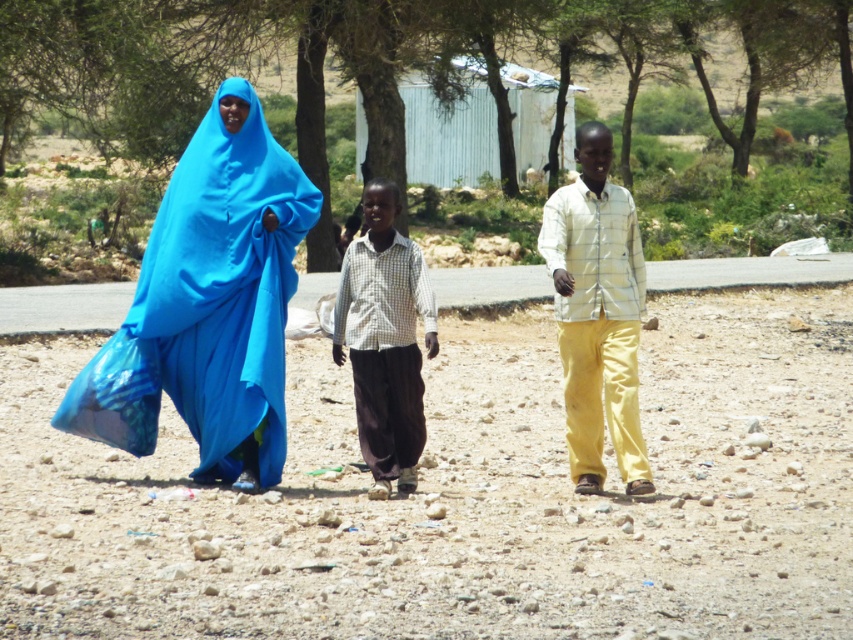
Is dusty gravel at center wider than white checkered shirt at center?

Yes.

Which is in front, point (42, 442) or point (405, 305)?

Positioned in front is point (405, 305).

Between point (728, 401) and point (416, 301), which one is positioned behind?

The point (728, 401) is more distant.

I want to click on dusty gravel at center, so click(x=461, y=497).

Does dusty gravel at center have a smaller size compared to blue fabric hijab at left?

No, dusty gravel at center is not smaller than blue fabric hijab at left.

Find the location of `dusty gravel at center`. dusty gravel at center is located at coordinates (461, 497).

Who is taller, white matte shirt at center or white checkered shirt at center?

With more height is white matte shirt at center.

The width and height of the screenshot is (853, 640). I want to click on white matte shirt at center, so click(x=596, y=314).